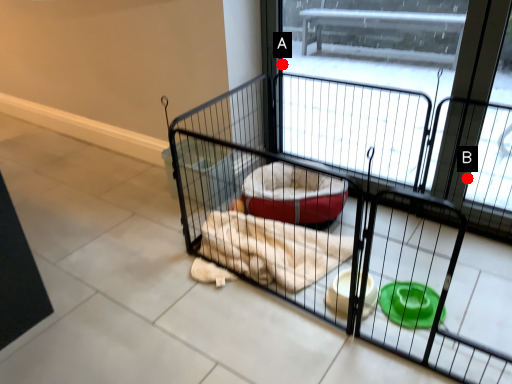
Question: Two points are circled on the image, labeled by A and B beside each circle. Which point is closer to the camera taking this photo?

Choices:
 (A) A is closer
 (B) B is closer

Answer: (B)